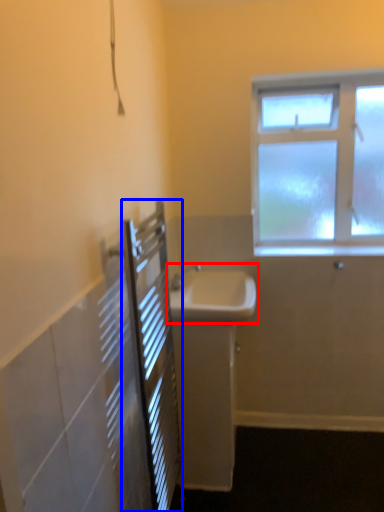
Question: Which object appears closest to the camera in this image, sink (highlighted by a red box) or screen door (highlighted by a blue box)?

Choices:
 (A) sink
 (B) screen door

Answer: (B)